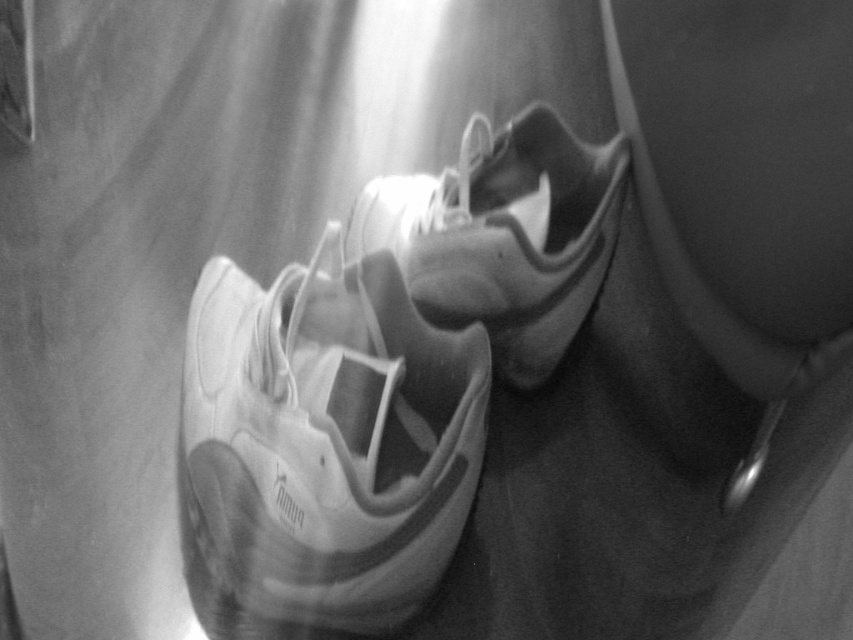
Question: Which of the following is the farthest from the observer?

Choices:
 (A) (520, 288)
 (B) (347, 307)

Answer: (A)

Question: Among these points, which one is nearest to the camera?

Choices:
 (A) (253, 362)
 (B) (604, 163)

Answer: (A)

Question: Does white matte shoe at center appear on the left side of white matte sneaker at center?

Choices:
 (A) no
 (B) yes

Answer: (B)

Question: Is white matte shoe at center behind white matte sneaker at center?

Choices:
 (A) no
 (B) yes

Answer: (A)

Question: Can you confirm if white matte shoe at center is positioned above white matte sneaker at center?

Choices:
 (A) yes
 (B) no

Answer: (B)